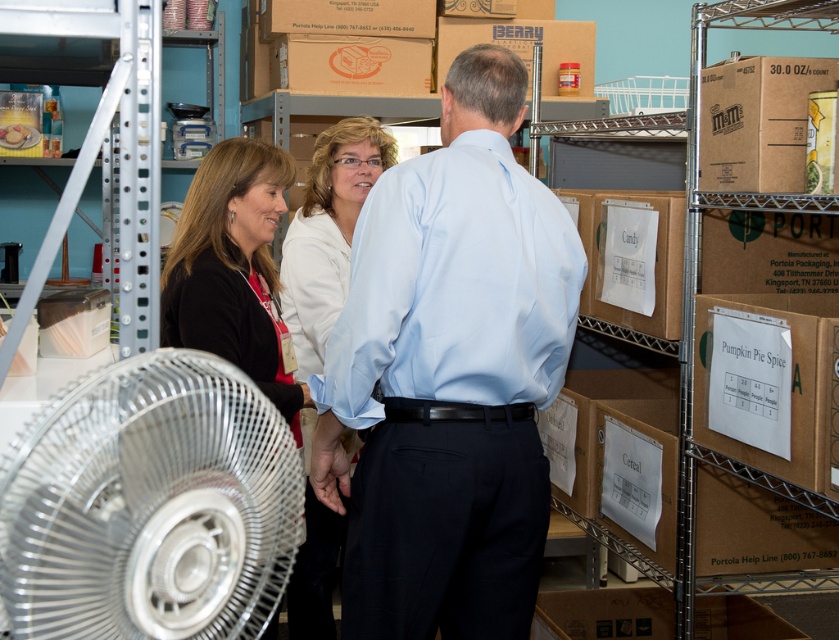
The width and height of the screenshot is (839, 640). What do you see at coordinates (769, 384) in the screenshot?
I see `white cardboard pumpkin pie spice at right` at bounding box center [769, 384].

Can you confirm if white cardboard pumpkin pie spice at right is bigger than brown cardboard box at upper right?

Yes.

Is point (837, 483) more distant than point (751, 145)?

No, it is in front of (751, 145).

Where is `white cardboard pumpkin pie spice at right`? The height and width of the screenshot is (640, 839). white cardboard pumpkin pie spice at right is located at coordinates point(769,384).

Who is shorter, brown cardboard box at upper right or brown cardboard box at upper center?

brown cardboard box at upper center is shorter.

Which is behind, point (791, 161) or point (555, 72)?

Point (555, 72)

Does point (717, 99) come behind point (538, 19)?

No, (717, 99) is closer to viewer.

In order to click on brown cardboard box at upper right in this screenshot , I will do `click(758, 122)`.

Does black fabric jacket at center have a larger size compared to white cardboard pumpkin pie spice at right?

Correct, black fabric jacket at center is larger in size than white cardboard pumpkin pie spice at right.

Who is shorter, black fabric jacket at center or white cardboard pumpkin pie spice at right?

white cardboard pumpkin pie spice at right

Is point (214, 269) closer to camera compared to point (808, 372)?

No, it is behind (808, 372).

What are the coordinates of `black fabric jacket at center` in the screenshot? It's located at click(x=233, y=269).